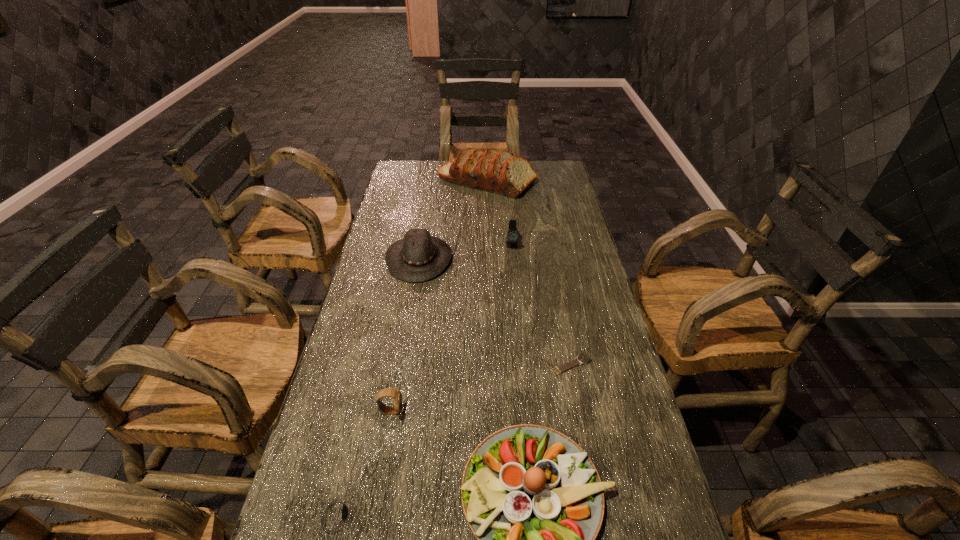
Image resolution: width=960 pixels, height=540 pixels. I want to click on free spot located on the face of the farthest watch, so click(x=519, y=328).

At what (x,y) coordinates should I click in order to perform the action: click on free region located 0.270m on the front-facing side of the hat. Please return your answer as a coordinate pair (x, y). Image resolution: width=960 pixels, height=540 pixels. Looking at the image, I should click on (530, 258).

Identify the location of free space located 0.090m on the face of the second tallest watch. (439, 411).

Find the location of `blank space located 0.140m on the back of the shortest object`. blank space located 0.140m on the back of the shortest object is located at coordinates (563, 318).

Identify the location of object that is at the far edge. Image resolution: width=960 pixels, height=540 pixels. (501, 172).

Identify the location of hat at the left edge. (419, 257).

What are the coordinates of `watch that is at the left edge` in the screenshot? It's located at (387, 392).

Locate an element on the screen. This screenshot has height=540, width=960. bread present at the right edge is located at coordinates (501, 172).

Where is `watch present at the right edge`? The image size is (960, 540). watch present at the right edge is located at coordinates (584, 358).

You are a GUI agent. You are given a task and a screenshot of the screen. Output one action in this format:
    pyautogui.click(x=<x>, y=<y>)
    Task: Click on the object that is positioned at the far right corner
    This screenshot has height=540, width=960.
    Given the screenshot: What is the action you would take?
    pyautogui.click(x=501, y=172)